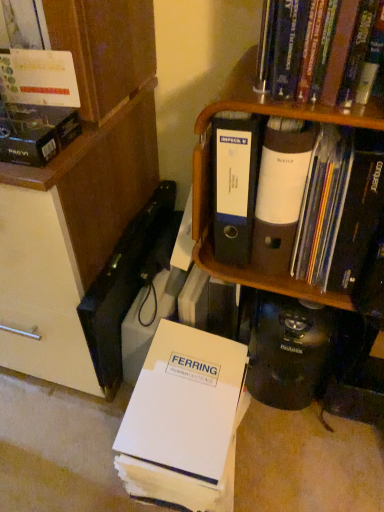
Question: Is matte cardboard box at upper left, placed as the second book when sorted from top to bottom, bigger than brown cardboard shelf at upper right?

Choices:
 (A) yes
 (B) no

Answer: (B)

Question: Does matte cardboard box at upper left, which is counted as the third book, starting from the bottom, have a smaller size compared to brown cardboard shelf at upper right?

Choices:
 (A) yes
 (B) no

Answer: (A)

Question: From a real-world perspective, is matte cardboard box at upper left, which is counted as the third book, starting from the bottom, below brown cardboard shelf at upper right?

Choices:
 (A) yes
 (B) no

Answer: (B)

Question: Can you confirm if matte cardboard box at upper left, which is counted as the third book, starting from the bottom, is positioned to the right of brown cardboard shelf at upper right?

Choices:
 (A) no
 (B) yes

Answer: (A)

Question: From the image's perspective, is matte cardboard box at upper left, which is counted as the third book, starting from the bottom, under brown cardboard shelf at upper right?

Choices:
 (A) yes
 (B) no

Answer: (B)

Question: From a real-world perspective, is matte cardboard box at upper left, placed as the second book when sorted from top to bottom, positioned over brown cardboard shelf at upper right based on gravity?

Choices:
 (A) yes
 (B) no

Answer: (A)

Question: Can we say white paper folder at lower center, placed as the 4th book when sorted from top to bottom, lies outside matte black folder at upper right, the third book positioned from the top?

Choices:
 (A) no
 (B) yes

Answer: (B)

Question: From a real-world perspective, is white paper folder at lower center, placed as the 4th book when sorted from top to bottom, on matte black folder at upper right, the second book positioned from the bottom?

Choices:
 (A) no
 (B) yes

Answer: (A)

Question: Is white paper folder at lower center, placed as the 4th book when sorted from top to bottom, behind matte black folder at upper right, the third book positioned from the top?

Choices:
 (A) no
 (B) yes

Answer: (B)

Question: Is white paper folder at lower center, positioned as the first book in bottom-to-top order, to the left of matte black folder at upper right, the third book positioned from the top, from the viewer's perspective?

Choices:
 (A) no
 (B) yes

Answer: (B)

Question: From the image's perspective, does white paper folder at lower center, positioned as the first book in bottom-to-top order, appear higher than matte black folder at upper right, the second book positioned from the bottom?

Choices:
 (A) yes
 (B) no

Answer: (B)

Question: Can you confirm if white paper folder at lower center, placed as the 4th book when sorted from top to bottom, is taller than matte black folder at upper right, the second book positioned from the bottom?

Choices:
 (A) no
 (B) yes

Answer: (A)

Question: From a real-world perspective, is hardcover book at upper right, the 4th book positioned from the bottom, on top of matte cardboard box at upper left, which is counted as the third book, starting from the bottom?

Choices:
 (A) yes
 (B) no

Answer: (A)